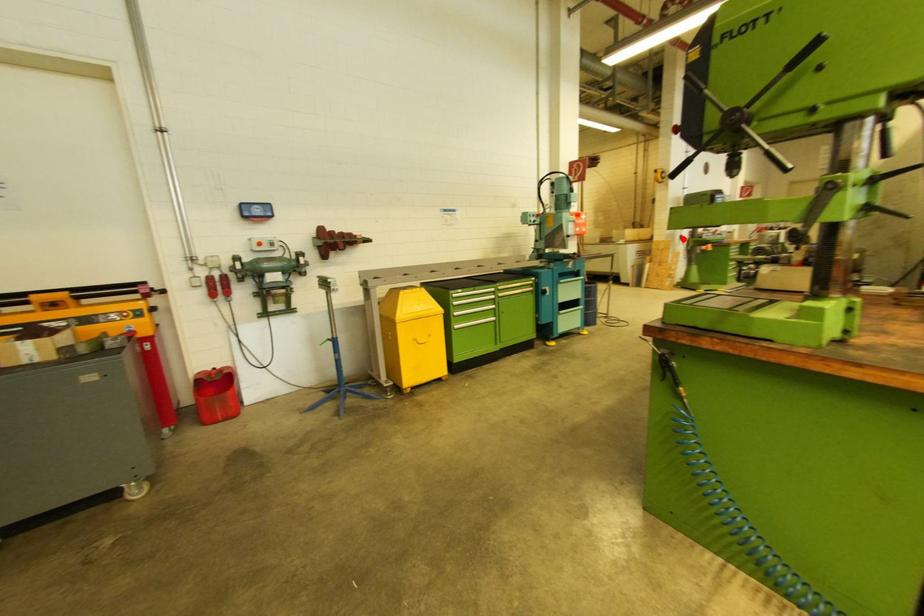
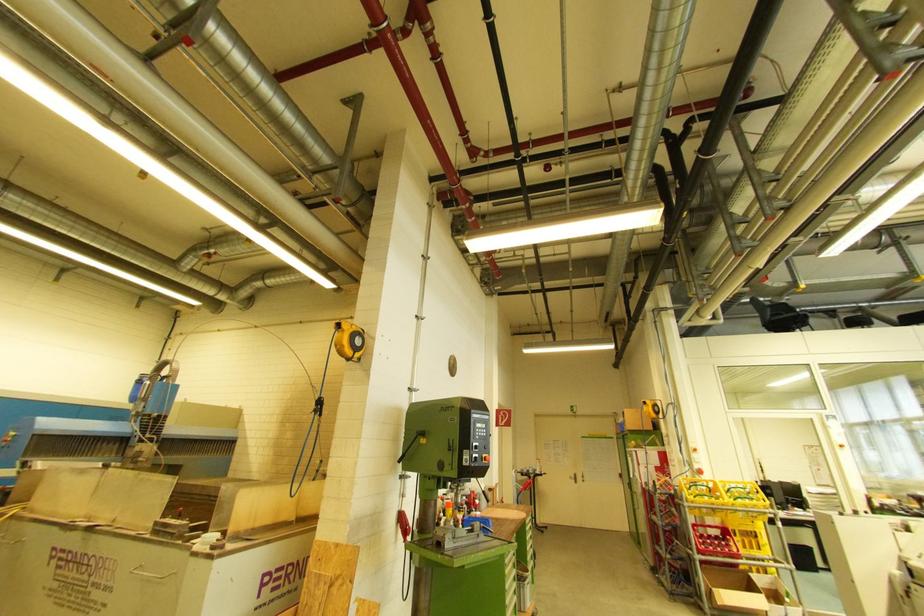
Question: I am providing you with two images of the same scene from different viewpoints. A red point is shown in image1. For the corresponding object point in image2, is it positioned nearer or farther from the camera?

Choices:
 (A) Nearer
 (B) Farther

Answer: (B)